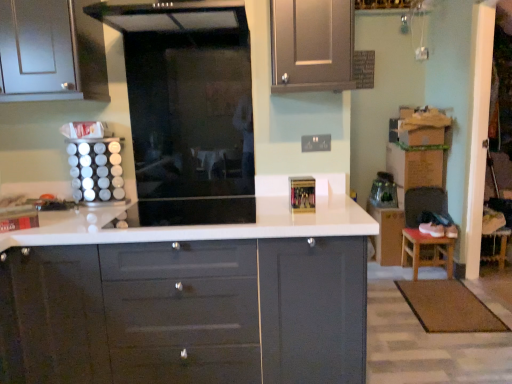
Question: Does white glossy countertop at center come behind matte gray cabinet at upper center?

Choices:
 (A) yes
 (B) no

Answer: (B)

Question: Is white glossy countertop at center placed right next to matte gray cabinet at upper center?

Choices:
 (A) no
 (B) yes

Answer: (A)

Question: Considering the relative positions of white glossy countertop at center and matte gray cabinet at upper center in the image provided, is white glossy countertop at center to the left of matte gray cabinet at upper center from the viewer's perspective?

Choices:
 (A) no
 (B) yes

Answer: (B)

Question: Does white glossy countertop at center have a lesser height compared to matte gray cabinet at upper center?

Choices:
 (A) no
 (B) yes

Answer: (A)

Question: Considering the relative sizes of white glossy countertop at center and matte gray cabinet at upper center in the image provided, is white glossy countertop at center bigger than matte gray cabinet at upper center?

Choices:
 (A) no
 (B) yes

Answer: (B)

Question: From a real-world perspective, is white glossy countertop at center positioned over matte gray cabinet at upper center based on gravity?

Choices:
 (A) no
 (B) yes

Answer: (A)

Question: Is brown wooden stool at lower right not close to white glossy countertop at center?

Choices:
 (A) no
 (B) yes

Answer: (B)

Question: From a real-world perspective, is brown wooden stool at lower right below white glossy countertop at center?

Choices:
 (A) yes
 (B) no

Answer: (A)

Question: From the image's perspective, is brown wooden stool at lower right located above white glossy countertop at center?

Choices:
 (A) yes
 (B) no

Answer: (A)

Question: Is brown wooden stool at lower right located outside white glossy countertop at center?

Choices:
 (A) yes
 (B) no

Answer: (A)

Question: Is brown wooden stool at lower right surrounding white glossy countertop at center?

Choices:
 (A) yes
 (B) no

Answer: (B)

Question: From the image's perspective, is brown wooden stool at lower right beneath white glossy countertop at center?

Choices:
 (A) yes
 (B) no

Answer: (B)

Question: From a real-world perspective, is transparent glass door at center positioned over white glossy spice rack at left based on gravity?

Choices:
 (A) yes
 (B) no

Answer: (A)